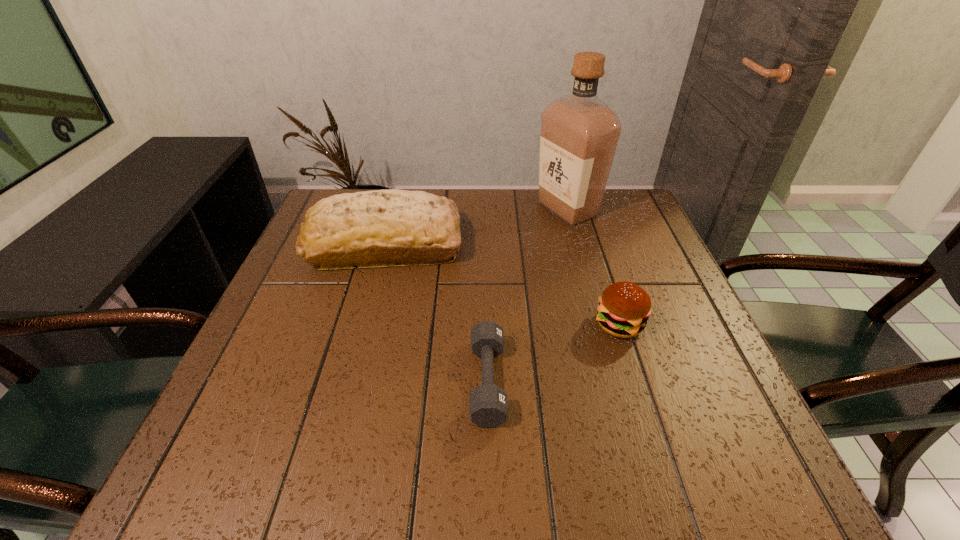
I want to click on empty space between the hamburger and the second object from left to right, so click(554, 353).

In order to click on free space between the leftmost object and the shortest object in this screenshot , I will do `click(437, 313)`.

Where is `vacant space that is in between the second object from left to right and the tallest object`? This screenshot has width=960, height=540. vacant space that is in between the second object from left to right and the tallest object is located at coordinates (528, 295).

This screenshot has height=540, width=960. I want to click on vacant space that's between the liquor and the shortest object, so click(528, 295).

The height and width of the screenshot is (540, 960). What are the coordinates of `free space between the second shortest object and the dumbbell` in the screenshot? It's located at (554, 353).

Identify which object is the second closest to the liquor. Please provide its 2D coordinates. Your answer should be formatted as a tuple, i.e. [(x, y)], where the tuple contains the x and y coordinates of a point satisfying the conditions above.

[(624, 307)]

Locate an element on the screen. The width and height of the screenshot is (960, 540). object that is the closest to the bread is located at coordinates (579, 135).

I want to click on vacant region that satisfies the following two spatial constraints: 1. on the front-facing side of the liquor; 2. on the front side of the bread, so click(x=577, y=245).

Identify the location of vacant space that satisfies the following two spatial constraints: 1. on the front-facing side of the tallest object; 2. on the right side of the second shortest object. Image resolution: width=960 pixels, height=540 pixels. (599, 324).

Where is `vacant space that satisfies the following two spatial constraints: 1. on the front side of the dumbbell; 2. on the right side of the bread`? vacant space that satisfies the following two spatial constraints: 1. on the front side of the dumbbell; 2. on the right side of the bread is located at coordinates (349, 381).